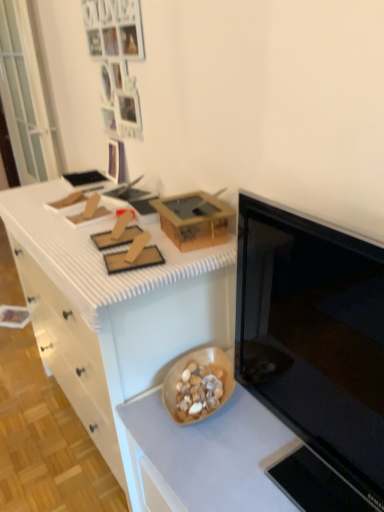
Where is `free spot below black glossy microwave at right (from a real-world perspective)`? This screenshot has width=384, height=512. free spot below black glossy microwave at right (from a real-world perspective) is located at coordinates (287, 462).